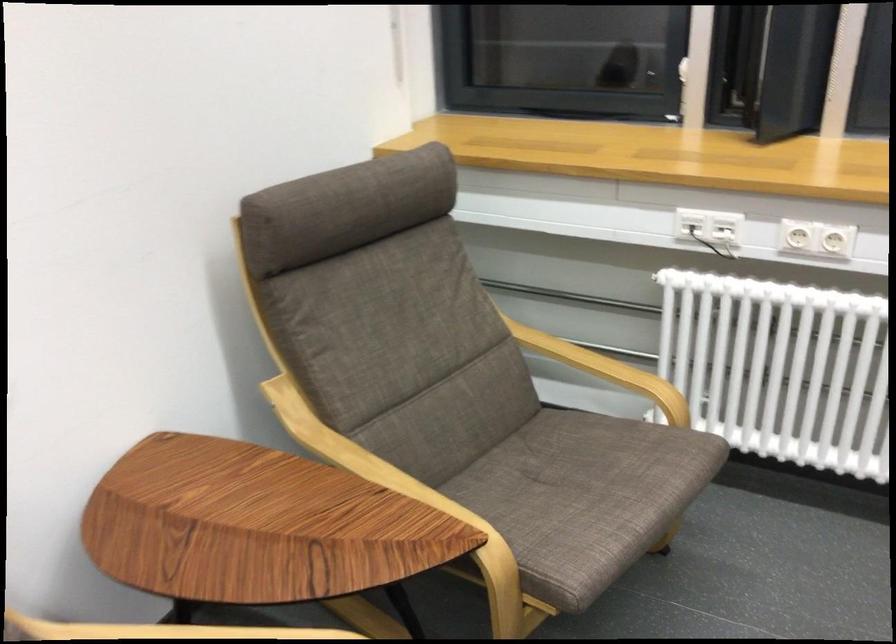
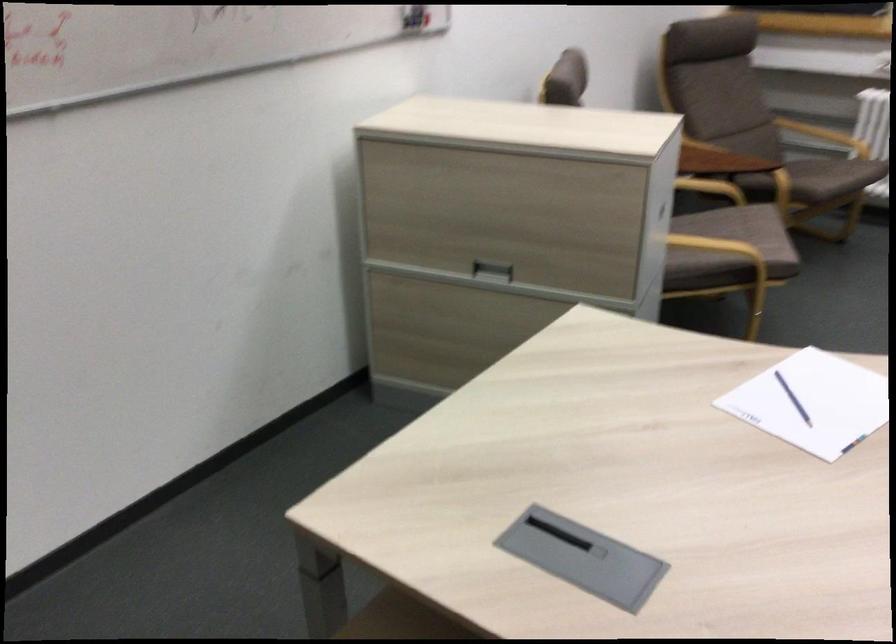
Locate, in the second image, the point that corresponds to (x=574, y=553) in the first image.

(831, 176)